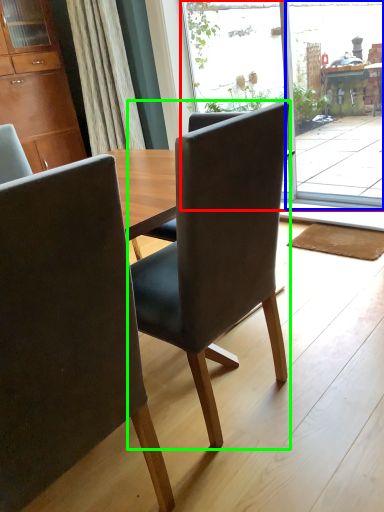
Question: Which object is positioned closest to glass door (highlighted by a red box)? Select from screen door (highlighted by a blue box) and chair (highlighted by a green box).

Choices:
 (A) screen door
 (B) chair

Answer: (A)